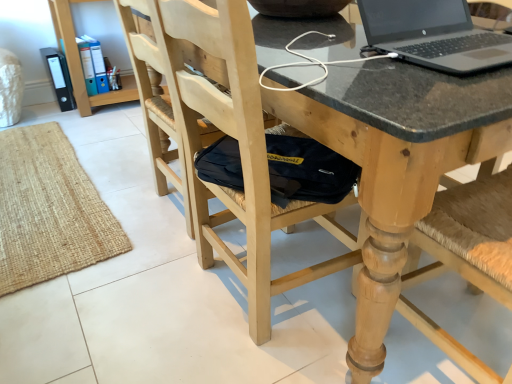
Question: Is natural wood chair at center, the first chair viewed from the left, to the right of matte black folders at upper left from the viewer's perspective?

Choices:
 (A) yes
 (B) no

Answer: (A)

Question: From the image's perspective, would you say natural wood chair at center, which is the second chair in right-to-left order, is shown under matte black folders at upper left?

Choices:
 (A) no
 (B) yes

Answer: (B)

Question: Does natural wood chair at center, which is the second chair in right-to-left order, appear on the left side of matte black folders at upper left?

Choices:
 (A) no
 (B) yes

Answer: (A)

Question: From a real-world perspective, is natural wood chair at center, the first chair viewed from the left, on top of matte black folders at upper left?

Choices:
 (A) no
 (B) yes

Answer: (B)

Question: Is natural wood chair at center, the first chair viewed from the left, facing towards matte black folders at upper left?

Choices:
 (A) no
 (B) yes

Answer: (A)

Question: Considering their positions, is wooden chair at center, the first chair when ordered from right to left, located in front of or behind natural wood chair at center, which is the second chair in right-to-left order?

Choices:
 (A) behind
 (B) front

Answer: (B)

Question: From their relative heights in the image, would you say wooden chair at center, the second chair in the left-to-right sequence, is taller or shorter than natural wood chair at center, the first chair viewed from the left?

Choices:
 (A) short
 (B) tall

Answer: (B)

Question: Based on their positions, is wooden chair at center, the first chair when ordered from right to left, located to the left or right of natural wood chair at center, the first chair viewed from the left?

Choices:
 (A) right
 (B) left

Answer: (A)

Question: Is wooden chair at center, the second chair in the left-to-right sequence, spatially inside natural wood chair at center, the first chair viewed from the left, or outside of it?

Choices:
 (A) outside
 (B) inside

Answer: (B)

Question: From the image's perspective, relative to black glossy laptop at upper right, is natural wood chair at center, which is the second chair in right-to-left order, above or below?

Choices:
 (A) above
 (B) below

Answer: (B)

Question: In terms of width, does natural wood chair at center, which is the second chair in right-to-left order, look wider or thinner when compared to black glossy laptop at upper right?

Choices:
 (A) wide
 (B) thin

Answer: (A)

Question: Is natural wood chair at center, the first chair viewed from the left, bigger or smaller than black glossy laptop at upper right?

Choices:
 (A) small
 (B) big

Answer: (B)

Question: In the image, is natural wood chair at center, which is the second chair in right-to-left order, positioned in front of or behind black glossy laptop at upper right?

Choices:
 (A) behind
 (B) front

Answer: (B)

Question: From a real-world perspective, is matte black folders at upper left positioned above or below black glossy laptop at upper right?

Choices:
 (A) below
 (B) above

Answer: (A)

Question: Looking at their shapes, would you say matte black folders at upper left is wider or thinner than black glossy laptop at upper right?

Choices:
 (A) wide
 (B) thin

Answer: (A)